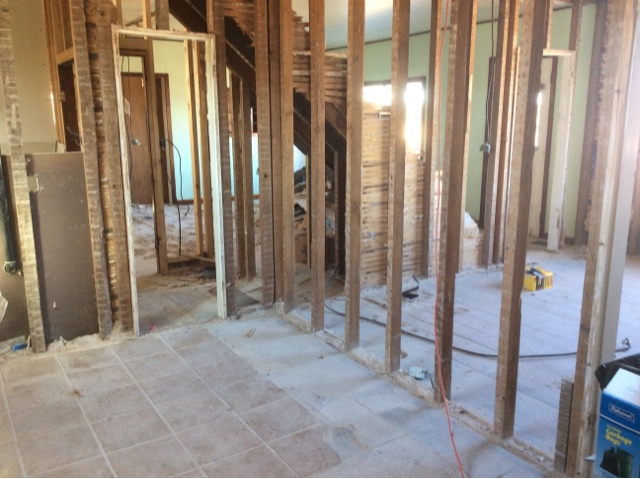
I want to click on box for binbags, so click(x=620, y=444).